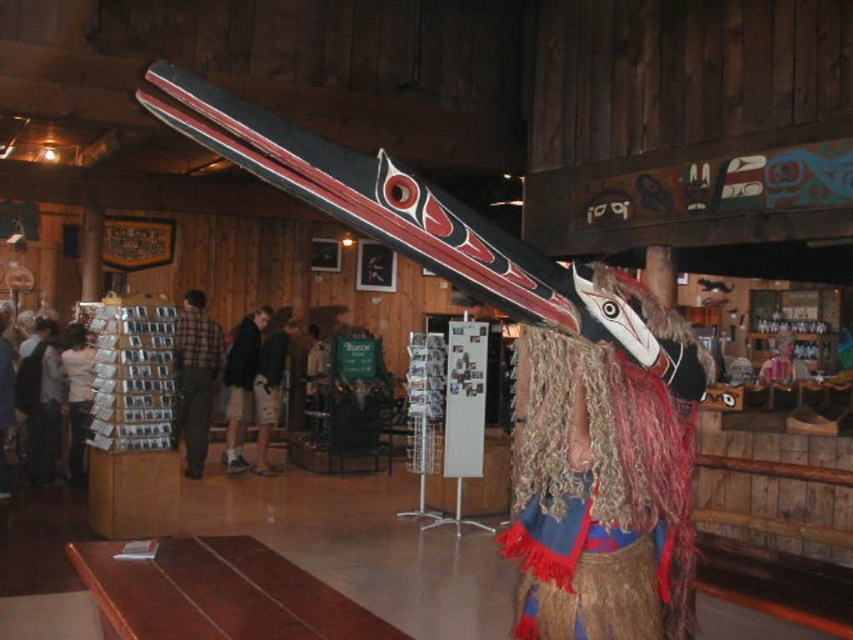
You are a photographer trying to capture a clear shot of both the carved wooden mask at center and the matte black jacket at center. Based on their widths, which object should you focus on first to ensure it fits entirely within the frame?

The carved wooden mask at center might be wider than the matte black jacket at center, so focusing on it first would ensure it fits within the frame.

From the picture: You are a visitor in the exhibit and want to take a photo of the carved wooden mask at center and the pink fabric at lower right together in the same frame. Considering your camera has a maximum zoom range of 10 feet, can you capture both objects in one shot without moving your position?

The distance between the carved wooden mask at center and the pink fabric at lower right is 22.19 feet, which exceeds the camera maximum zoom range of 10 feet. Therefore, you cannot capture both objects in one shot without moving your position.